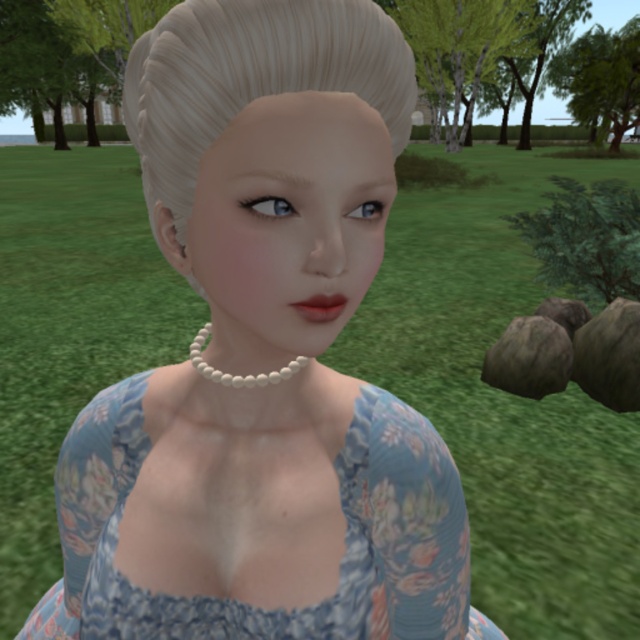
Question: Which object appears closest to the camera in this image?

Choices:
 (A) blue floral fabric dress at center
 (B) blonde smooth hair at center

Answer: (B)

Question: Which of the following is the farthest from the observer?

Choices:
 (A) blonde smooth hair at center
 (B) blue floral fabric dress at center

Answer: (B)

Question: Can you confirm if blue floral fabric dress at center is wider than blonde smooth hair at center?

Choices:
 (A) no
 (B) yes

Answer: (B)

Question: Is blue floral fabric dress at center thinner than blonde smooth hair at center?

Choices:
 (A) no
 (B) yes

Answer: (A)

Question: Which point appears closest to the camera in this image?

Choices:
 (A) (332, 67)
 (B) (355, 493)

Answer: (A)

Question: Does blue floral fabric dress at center come in front of blonde smooth hair at center?

Choices:
 (A) yes
 (B) no

Answer: (B)